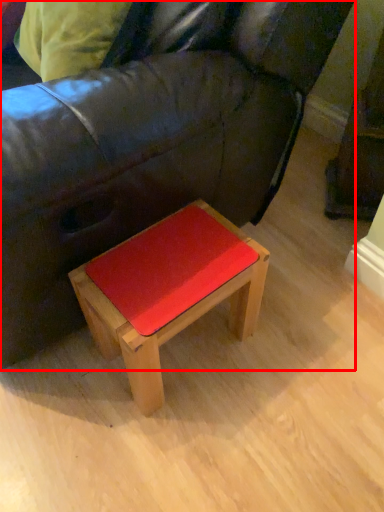
Question: In this image, where is studio couch (annotated by the red box) located relative to table?

Choices:
 (A) right
 (B) left

Answer: (B)